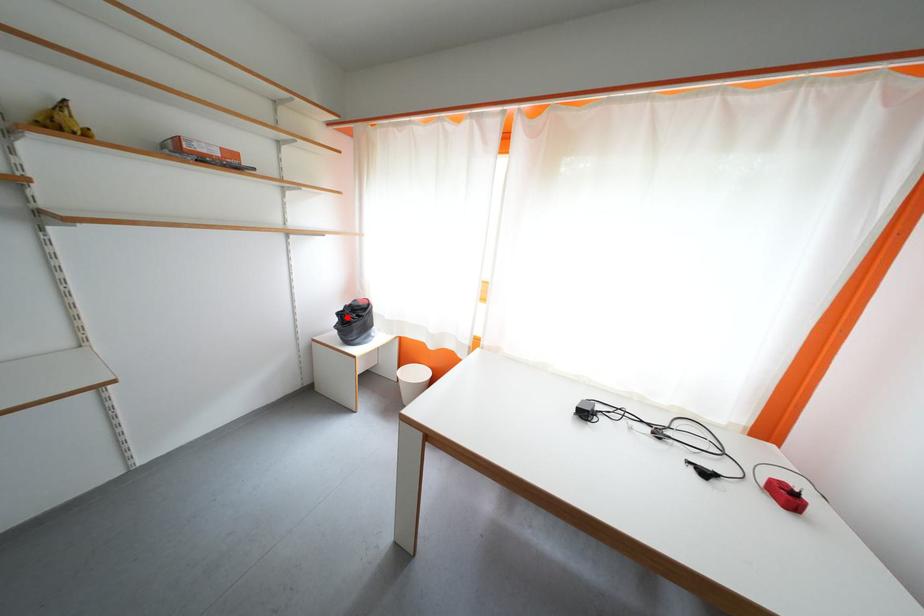
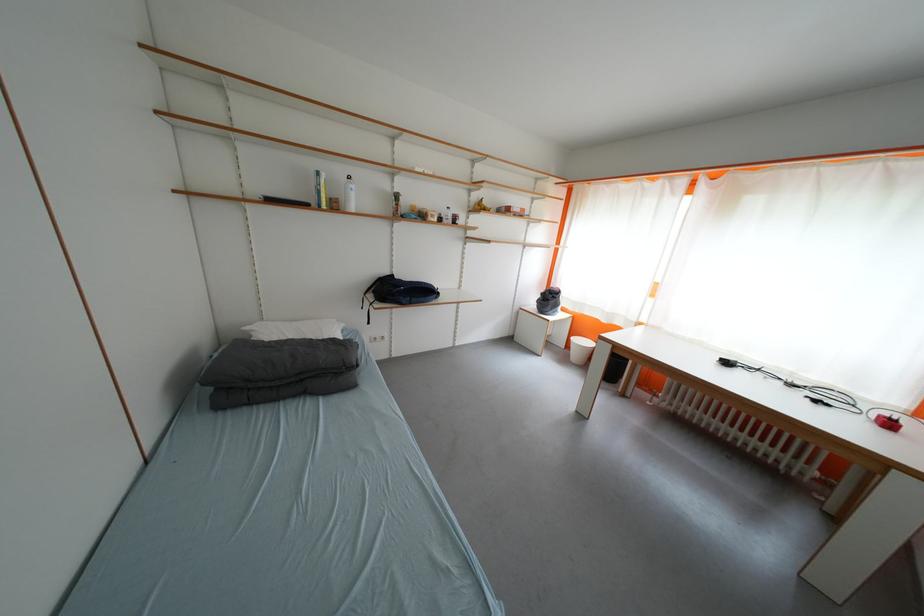
In the second image, find the point that corresponds to the highlighted location in the first image.

(551, 297)